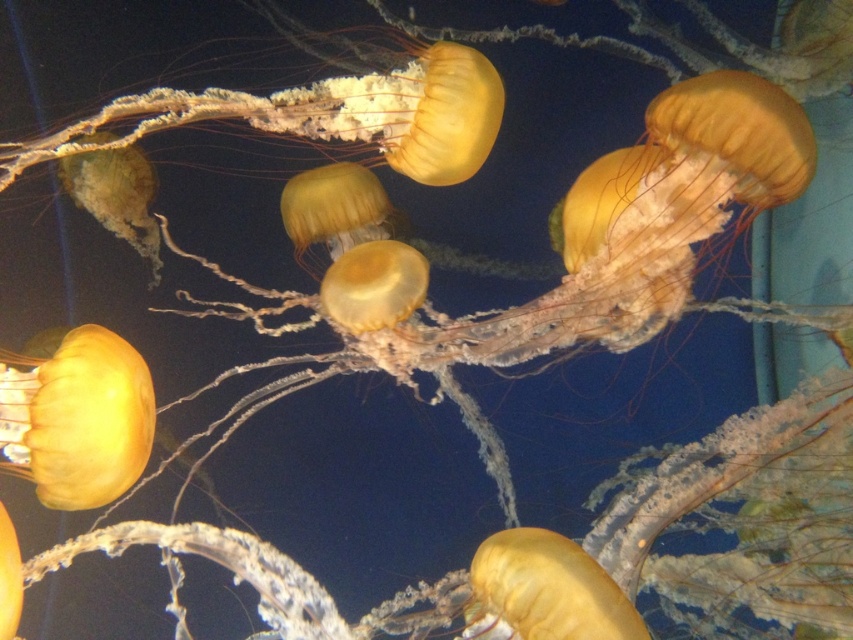
You are an underwater photographer aiming to capture a photo of the translucent yellow jellyfish at upper center and the translucent yellow jellyfish at bottom left. Which jellyfish is located higher in the water column?

The translucent yellow jellyfish at upper center is positioned higher in the water column than the translucent yellow jellyfish at bottom left.

You are an underwater photographer aiming to capture the largest jellyfish in the tank. Which jellyfish should you focus on between the translucent yellow jellyfish at center and the translucent yellow jellyfish at upper center?

The translucent yellow jellyfish at center has a greater height compared to the translucent yellow jellyfish at upper center, so you should focus on the translucent yellow jellyfish at center to capture the largest one.

You are an underwater photographer aiming to capture a closeup of the translucent yellow jellyfish at center. Based on its coordinates, where should you position your camera to ensure it is centered in your shot?

The translucent yellow jellyfish at center is located at coordinates point (593, 253), so you should position your camera directly facing that point to center it in your shot.